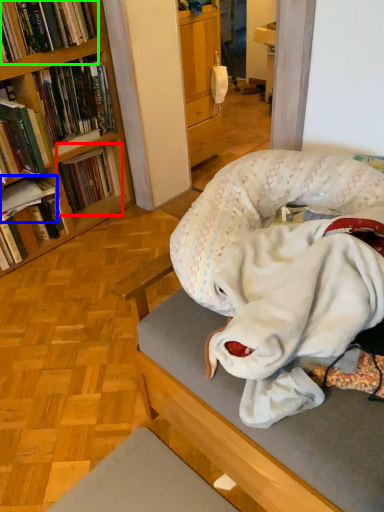
Question: Which object is the farthest from book (highlighted by a red box)? Choose among these: book (highlighted by a blue box) or book (highlighted by a green box).

Choices:
 (A) book
 (B) book

Answer: (B)